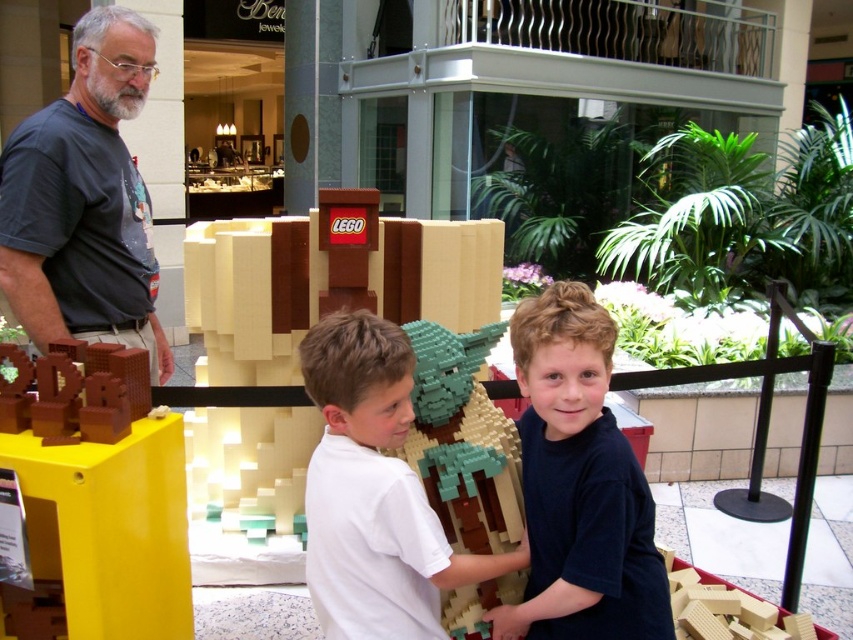
Question: Does matte brown blocks at left have a lesser width compared to brown matte building blocks at left?

Choices:
 (A) yes
 (B) no

Answer: (B)

Question: Considering the real-world distances, which object is closest to the brown matte lego structure at center?

Choices:
 (A) dark blue shirt at center
 (B) gray t-shirt at left

Answer: (B)

Question: Which of the following is the farthest from the observer?

Choices:
 (A) dark blue shirt at center
 (B) white matte shirt at center

Answer: (B)

Question: Where is brown matte lego structure at center located in relation to dark blue shirt at center in the image?

Choices:
 (A) below
 (B) above

Answer: (B)

Question: Observing the image, what is the correct spatial positioning of gray t-shirt at left in reference to dark blue shirt at center?

Choices:
 (A) left
 (B) right

Answer: (A)

Question: Among these objects, which one is nearest to the camera?

Choices:
 (A) white matte shirt at center
 (B) matte brown blocks at left
 (C) brown matte building blocks at left

Answer: (A)